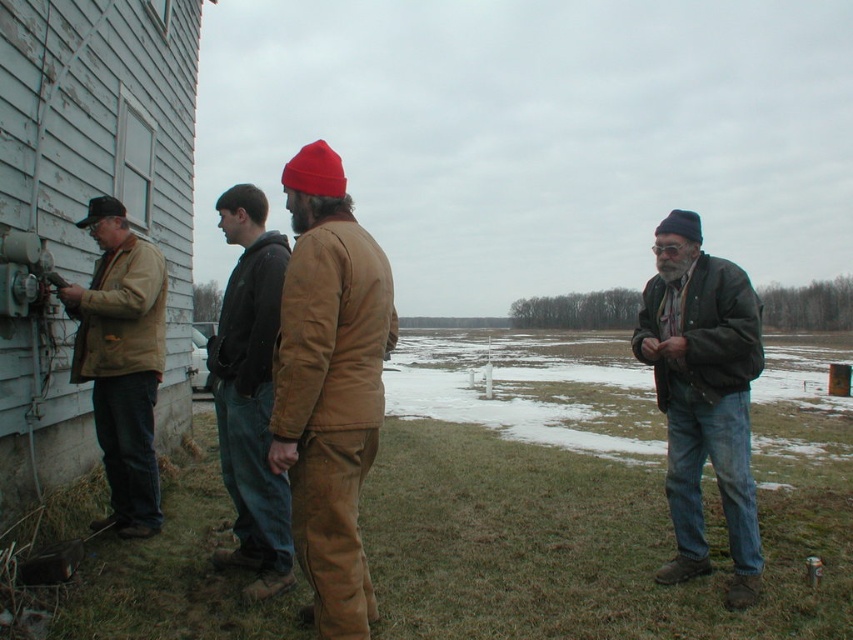
Can you confirm if brown corduroy pants at center is smaller than dark green leather jacket at right?

Yes.

Locate an element on the screen. The image size is (853, 640). brown corduroy pants at center is located at coordinates (329, 385).

Describe the element at coordinates (329, 385) in the screenshot. This screenshot has height=640, width=853. I see `brown corduroy pants at center` at that location.

Identify the location of brown corduroy pants at center. (329, 385).

Between dark green leather jacket at right and matte brown jacket at left, which one appears on the right side from the viewer's perspective?

dark green leather jacket at right is more to the right.

Who is more forward, (674, 493) or (155, 460)?

Point (674, 493) is more forward.

Who is more forward, [666,241] or [94,387]?

Point [666,241] is more forward.

You are a GUI agent. You are given a task and a screenshot of the screen. Output one action in this format:
    pyautogui.click(x=<x>, y=<y>)
    Task: Click on the dark green leather jacket at right
    This screenshot has height=640, width=853.
    Given the screenshot: What is the action you would take?
    pyautogui.click(x=703, y=396)

Describe the element at coordinates (703, 396) in the screenshot. This screenshot has width=853, height=640. I see `dark green leather jacket at right` at that location.

Between dark green leather jacket at right and brown leather jacket at center, which one appears on the right side from the viewer's perspective?

Positioned to the right is dark green leather jacket at right.

Is point (685, 275) more distant than point (248, 385)?

Yes, point (685, 275) is farther from viewer.

The image size is (853, 640). Find the location of `dark green leather jacket at right`. dark green leather jacket at right is located at coordinates (703, 396).